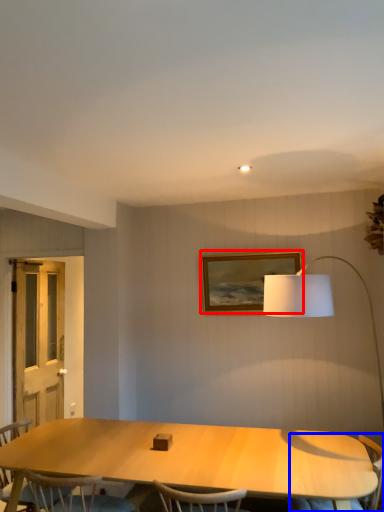
Question: Which object appears closest to the camera in this image, picture frame (highlighted by a red box) or armchair (highlighted by a blue box)?

Choices:
 (A) picture frame
 (B) armchair

Answer: (B)